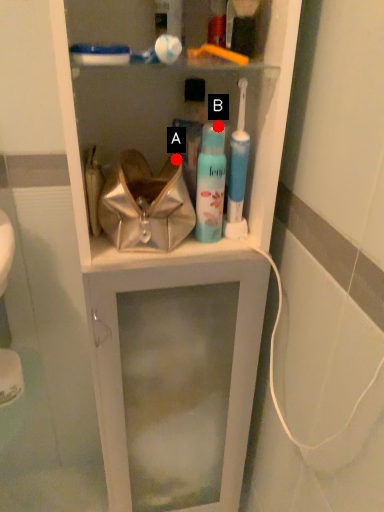
Question: Two points are circled on the image, labeled by A and B beside each circle. Which point is closer to the camera?

Choices:
 (A) A is closer
 (B) B is closer

Answer: (B)